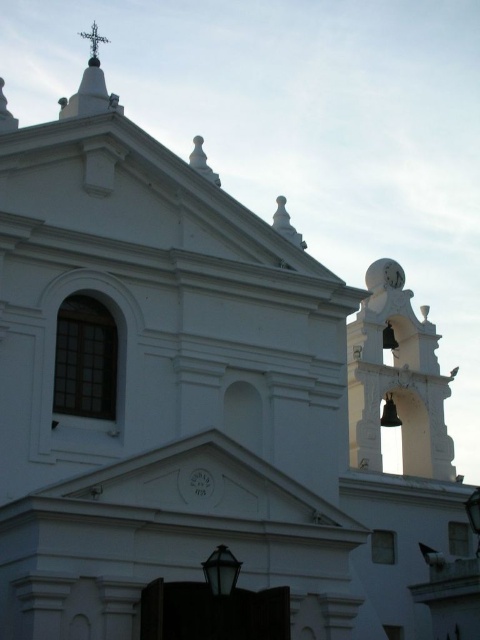
Is white glossy clock at center thinner than metallic clock at upper right?

Indeed, white glossy clock at center has a lesser width compared to metallic clock at upper right.

Is point (207, 492) farther from camera compared to point (399, 269)?

No, (207, 492) is closer to viewer.

Which is behind, point (192, 481) or point (386, 282)?

The point (386, 282) is more distant.

At what (x,y) coordinates should I click in order to perform the action: click on white glossy clock at center. Please return your answer as a coordinate pair (x, y). Looking at the image, I should click on (201, 483).

Is white glossy clock at center positioned before white stone cross at upper center?

That is True.

You are a GUI agent. You are given a task and a screenshot of the screen. Output one action in this format:
    pyautogui.click(x=<x>, y=<y>)
    Task: Click on the white glossy clock at center
    
    Given the screenshot: What is the action you would take?
    pyautogui.click(x=201, y=483)

Measure the distance between point (195, 474) and camera.

They are 49.35 meters apart.

I want to click on white glossy clock at center, so click(201, 483).

Does metallic clock at upper right appear over white stone cross at upper center?

No.

Is metallic clock at upper right shorter than white stone cross at upper center?

Correct, metallic clock at upper right is not as tall as white stone cross at upper center.

The height and width of the screenshot is (640, 480). I want to click on metallic clock at upper right, so click(393, 273).